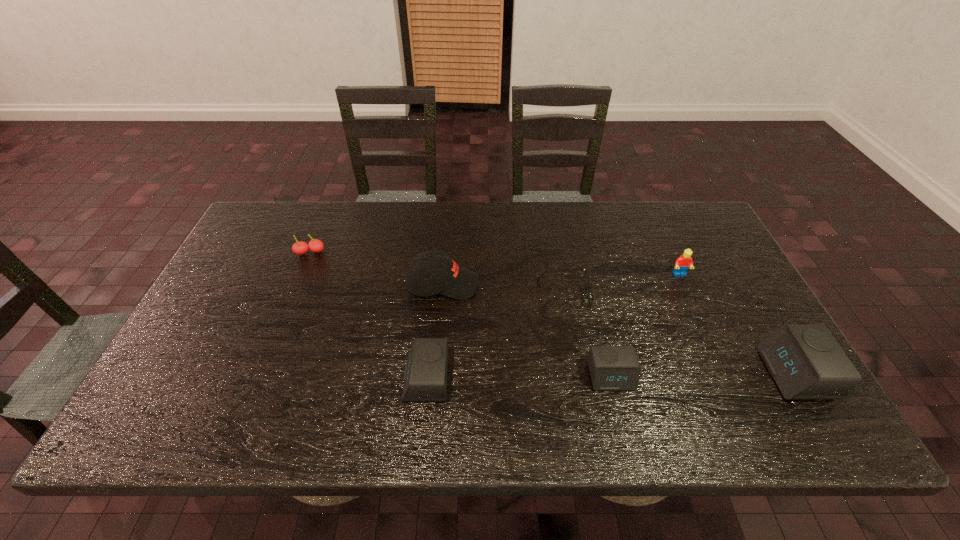
In order to click on object that is the sixth closest to the shortest object in this screenshot , I will do `click(300, 248)`.

Locate an element on the screen. object that can be found as the second closest to the leftmost alarm clock is located at coordinates (588, 287).

The height and width of the screenshot is (540, 960). In order to click on alarm clock that stands as the closest to the Lego in this screenshot , I will do `click(805, 360)`.

Where is `the closest alarm clock to the rightmost alarm clock`? The height and width of the screenshot is (540, 960). the closest alarm clock to the rightmost alarm clock is located at coordinates (612, 368).

Image resolution: width=960 pixels, height=540 pixels. Find the location of `vacant region that satisfies the following two spatial constraints: 1. on the front-facing side of the tallest alarm clock; 2. on the front-facing side of the shortest alarm clock`. vacant region that satisfies the following two spatial constraints: 1. on the front-facing side of the tallest alarm clock; 2. on the front-facing side of the shortest alarm clock is located at coordinates (796, 376).